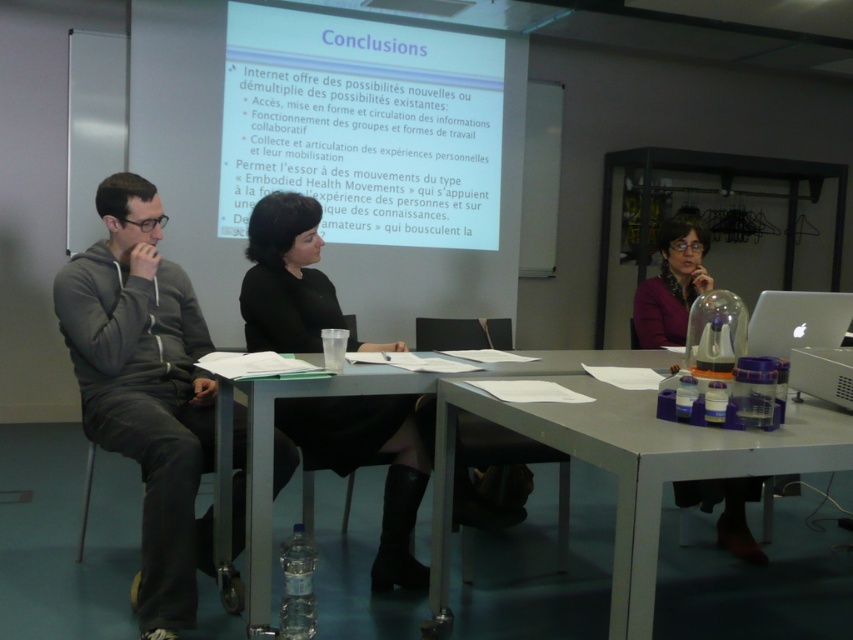
Is metallic gray table at lower right shorter than black leather skirt at center?

Indeed, metallic gray table at lower right has a lesser height compared to black leather skirt at center.

Who is more distant from viewer, [653,525] or [299,401]?

Point [299,401]

Where is `metallic gray table at lower right`? metallic gray table at lower right is located at coordinates (625, 470).

This screenshot has width=853, height=640. I want to click on metallic gray table at lower right, so click(625, 470).

Who is shorter, gray hoodie at left or metallic gray table at center?

Standing shorter between the two is metallic gray table at center.

Who is lower down, gray hoodie at left or metallic gray table at center?

metallic gray table at center is below.

Describe the element at coordinates (144, 388) in the screenshot. I see `gray hoodie at left` at that location.

Image resolution: width=853 pixels, height=640 pixels. What are the coordinates of `gray hoodie at left` in the screenshot? It's located at (144, 388).

Looking at this image, between white matte projector screen at upper center and gray hoodie at left, which one appears on the left side from the viewer's perspective?

From the viewer's perspective, gray hoodie at left appears more on the left side.

What do you see at coordinates (363, 125) in the screenshot? I see `white matte projector screen at upper center` at bounding box center [363, 125].

This screenshot has height=640, width=853. Find the location of `white matte projector screen at upper center`. white matte projector screen at upper center is located at coordinates (363, 125).